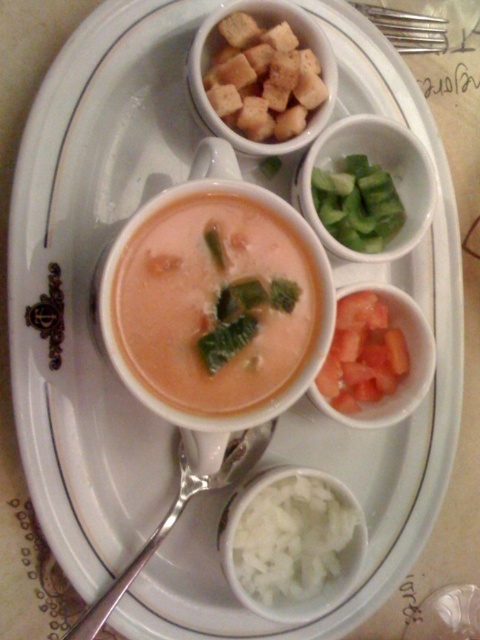
You are a diner who wants to add toppings to your soup. You have the white fluffy rice at lower center and the greencutcucumber at right. Which topping can you use more of because it takes up less space?

The white fluffy rice at lower center has a smaller size compared to the greencutcucumber at right, so you can use more of the white fluffy rice at lower center since it occupies less space.

You are a chef preparing a soup dish and need to arrange toppings on the tray. The tray has a white ceramic cup in the center with a spoon inside. You have two toppings to place around it. The white fluffy rice at lower center and the brown croutons at upper center. Which topping area is wider?

The white fluffy rice at lower center is wider than the brown croutons at upper center.